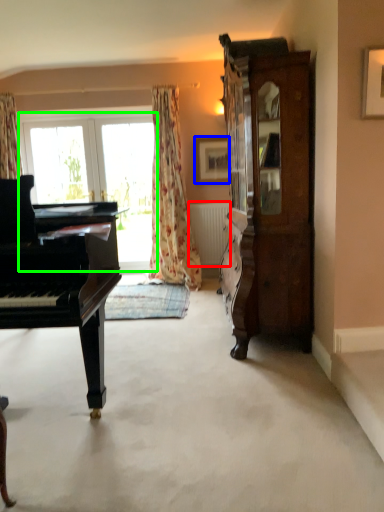
Question: Which is farther away from radiator (highlighted by a red box)? picture frame (highlighted by a blue box) or bay window (highlighted by a green box)?

Choices:
 (A) picture frame
 (B) bay window

Answer: (B)